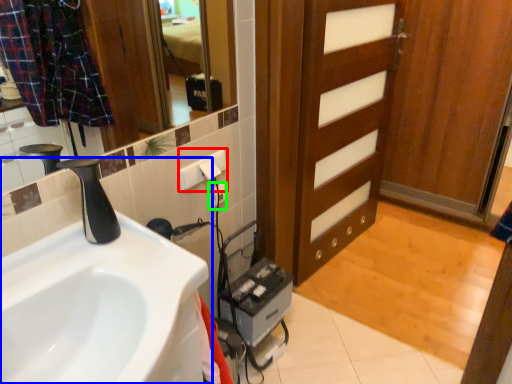
Question: Based on their relative distances, which object is farther from electric outlet (highlighted by a red box)? Choose from sink (highlighted by a blue box) and electric outlet (highlighted by a green box).

Choices:
 (A) sink
 (B) electric outlet

Answer: (A)